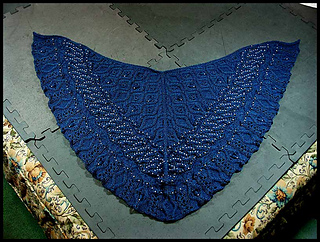
The image size is (320, 242). In order to click on blanket in this screenshot , I will do `click(164, 115)`.